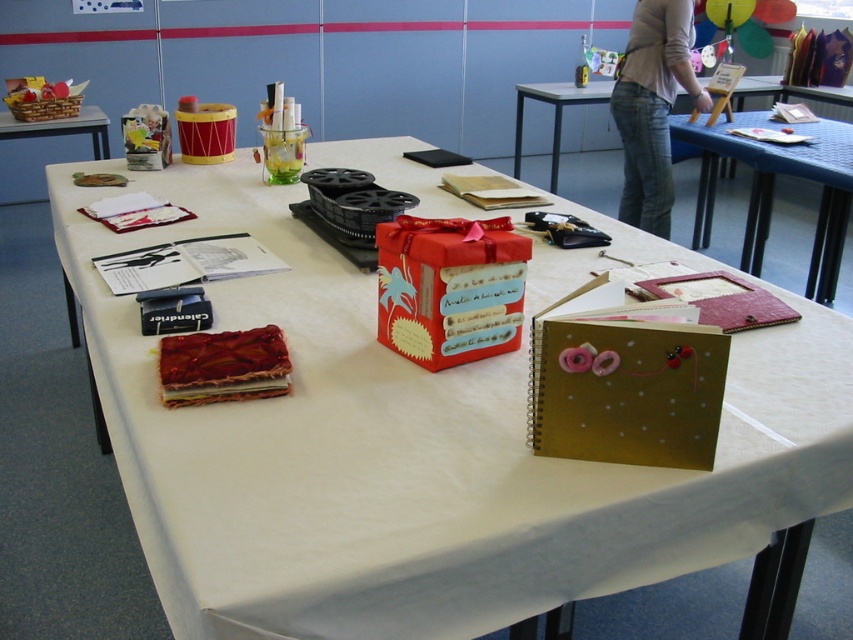
In the scene shown: Does blue fabric table at upper center appear on the left side of wooden crate at left?

In fact, blue fabric table at upper center is to the right of wooden crate at left.

Is point (589, 99) behind point (86, 122)?

Yes, point (589, 99) is farther from viewer.

The height and width of the screenshot is (640, 853). Identify the location of blue fabric table at upper center. (553, 113).

Can you confirm if shiny red gift box at center is bigger than wooden crate at left?

No, shiny red gift box at center is not bigger than wooden crate at left.

From the picture: Is shiny red gift box at center positioned before wooden crate at left?

Yes, it is.

Measure the distance between shiny red gift box at center and camera.

shiny red gift box at center is 1.20 meters away from camera.

This screenshot has height=640, width=853. What are the coordinates of `shiny red gift box at center` in the screenshot? It's located at (450, 289).

Is white fabric at center positioned behind wooden crate at left?

No.

Is white fabric at center to the right of wooden crate at left from the viewer's perspective?

Correct, you'll find white fabric at center to the right of wooden crate at left.

Find the location of `white fabric at center`. white fabric at center is located at coordinates (415, 451).